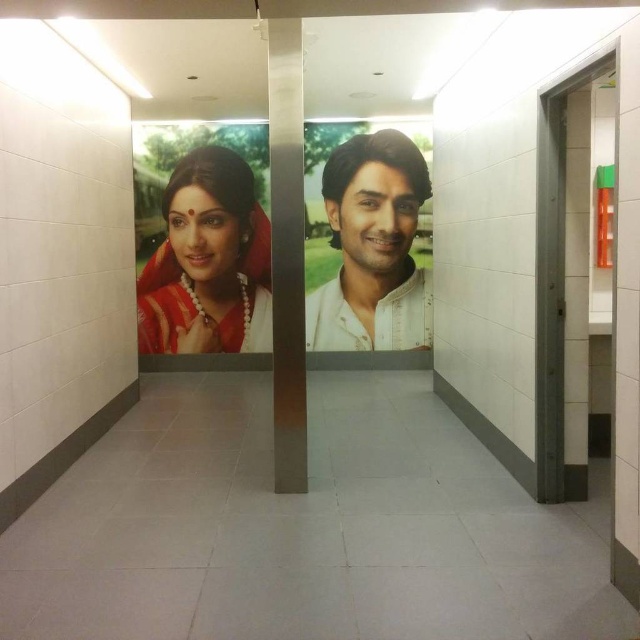
Question: Which object is closer to the camera taking this photo?

Choices:
 (A) matte red saree at center
 (B) white cotton shirt at center

Answer: (B)

Question: Observing the image, what is the correct spatial positioning of matte red saree at center in reference to white cotton shirt at center?

Choices:
 (A) above
 (B) below

Answer: (B)

Question: Which point is closer to the camera?

Choices:
 (A) (220, 202)
 (B) (330, 280)

Answer: (A)

Question: Does matte red saree at center appear on the right side of white cotton shirt at center?

Choices:
 (A) no
 (B) yes

Answer: (A)

Question: In this image, where is matte red saree at center located relative to white cotton shirt at center?

Choices:
 (A) left
 (B) right

Answer: (A)